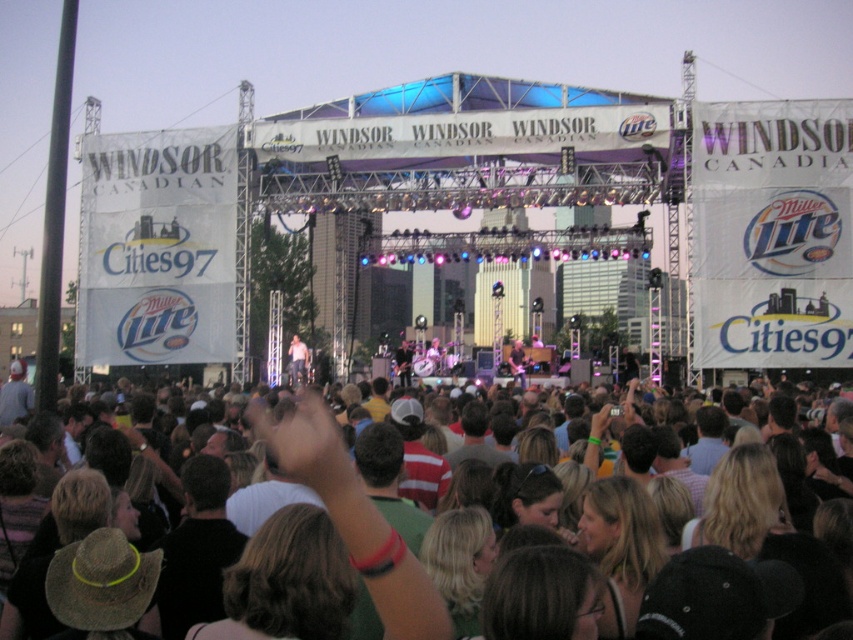
Question: Which of the following is the farthest from the observer?

Choices:
 (A) (289, 368)
 (B) (753, 493)

Answer: (A)

Question: Does dark brown hair at center appear over light brown leather jacket at center?

Choices:
 (A) no
 (B) yes

Answer: (A)

Question: Is dark brown hair at center thinner than light brown leather jacket at center?

Choices:
 (A) yes
 (B) no

Answer: (B)

Question: Is dark brown hair at center to the left of light brown leather jacket at center from the viewer's perspective?

Choices:
 (A) no
 (B) yes

Answer: (A)